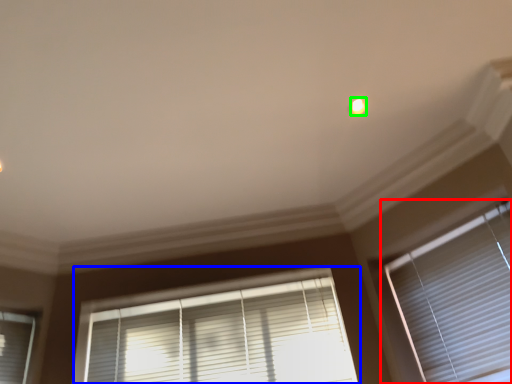
Question: Considering the real-world distances, which object is closest to window blind (highlighted by a red box)? window blind (highlighted by a blue box) or light (highlighted by a green box).

Choices:
 (A) window blind
 (B) light

Answer: (A)